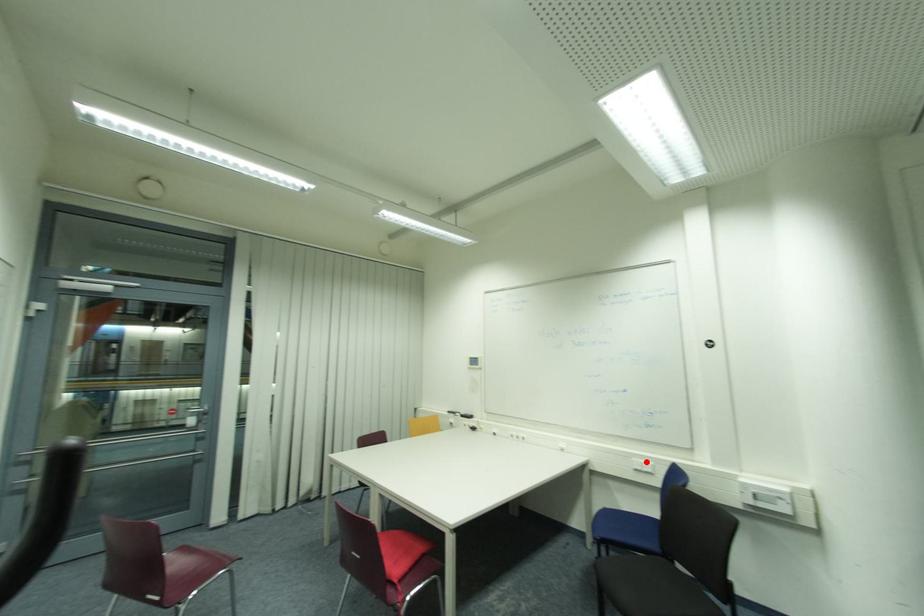
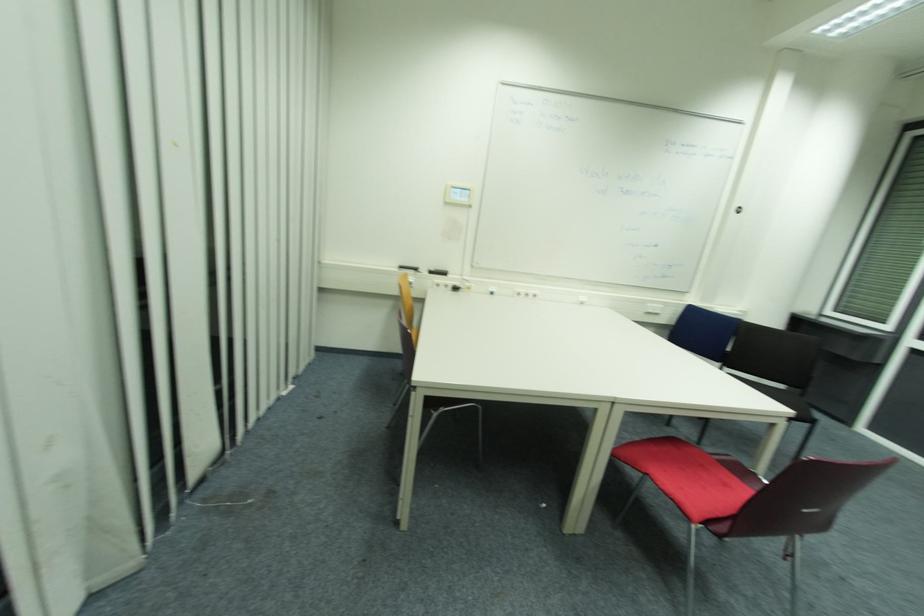
Question: I am providing you with two images of the same scene from different viewpoints. Image1 has a red point marked. In image2, the corresponding 3D location appears at what relative position? Reply with the corresponding letter.

Choices:
 (A) Closer
 (B) Farther

Answer: (A)